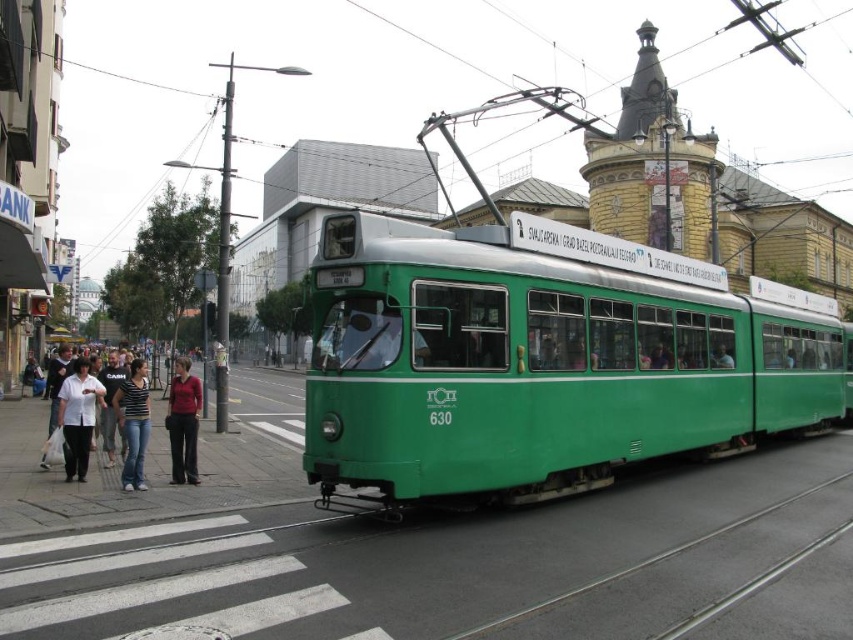
Is matte white shirt at lower left shorter than white cotton shirt at lower left?

No.

Between matte white shirt at lower left and white cotton shirt at lower left, which one is positioned lower?

Positioned lower is matte white shirt at lower left.

Does point (120, 404) come farther from viewer compared to point (80, 422)?

Yes, point (120, 404) is farther from viewer.

Identify the location of matte white shirt at lower left. The width and height of the screenshot is (853, 640). (126, 419).

Who is more distant from viewer, [77,474] or [181,404]?

The point [77,474] is more distant.

Is white cotton shirt at lower left positioned behind matte red shirt at center?

That is False.

What do you see at coordinates (78, 417) in the screenshot?
I see `white cotton shirt at lower left` at bounding box center [78, 417].

The width and height of the screenshot is (853, 640). In order to click on white cotton shirt at lower left in this screenshot , I will do `click(78, 417)`.

Is matte white shirt at lower left wider than striped t-shirt at center?

Yes.

I want to click on matte white shirt at lower left, so click(x=126, y=419).

Identify the location of matte white shirt at lower left. The width and height of the screenshot is (853, 640). [x=126, y=419].